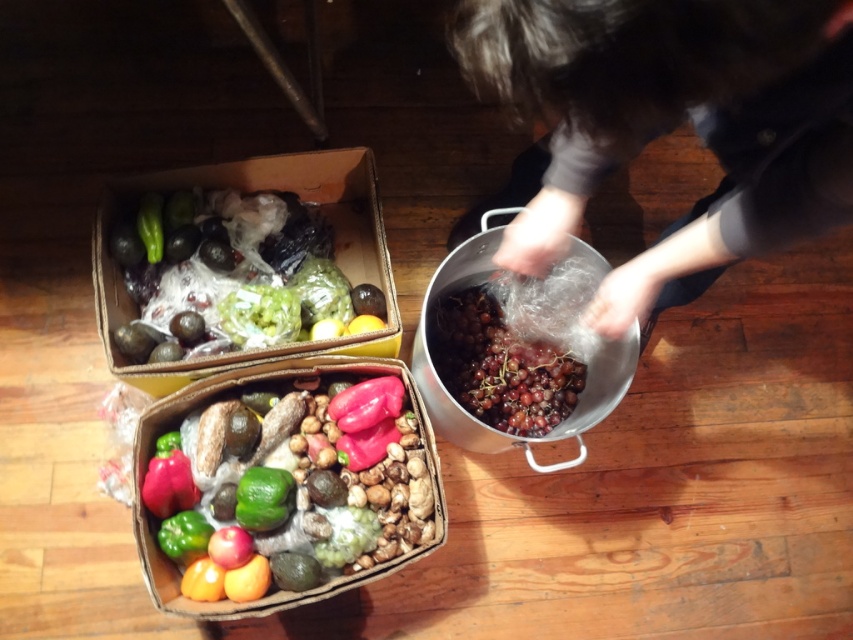
Question: Which object is the closest to the matte red pepper at lower left?

Choices:
 (A) shiny plastic peppers at center
 (B) green matte lime at lower center
 (C) smooth plastic bag at center
 (D) green matte pepper at lower left

Answer: (D)

Question: Does green matte lime at lower center have a greater width compared to green matte cucumber at upper left?

Choices:
 (A) no
 (B) yes

Answer: (B)

Question: From the image, what is the correct spatial relationship of smooth plastic bag at center in relation to green matte pepper at lower left?

Choices:
 (A) above
 (B) below

Answer: (A)

Question: Which object appears farthest from the camera in this image?

Choices:
 (A) matte red pepper at lower left
 (B) shiny plastic peppers at center

Answer: (A)

Question: Is shiny plastic peppers at center bigger than green matte lime at lower center?

Choices:
 (A) no
 (B) yes

Answer: (B)

Question: Which point is closer to the camera taking this photo?

Choices:
 (A) (x=152, y=224)
 (B) (x=161, y=536)
 (C) (x=190, y=493)
 (D) (x=814, y=68)

Answer: (D)